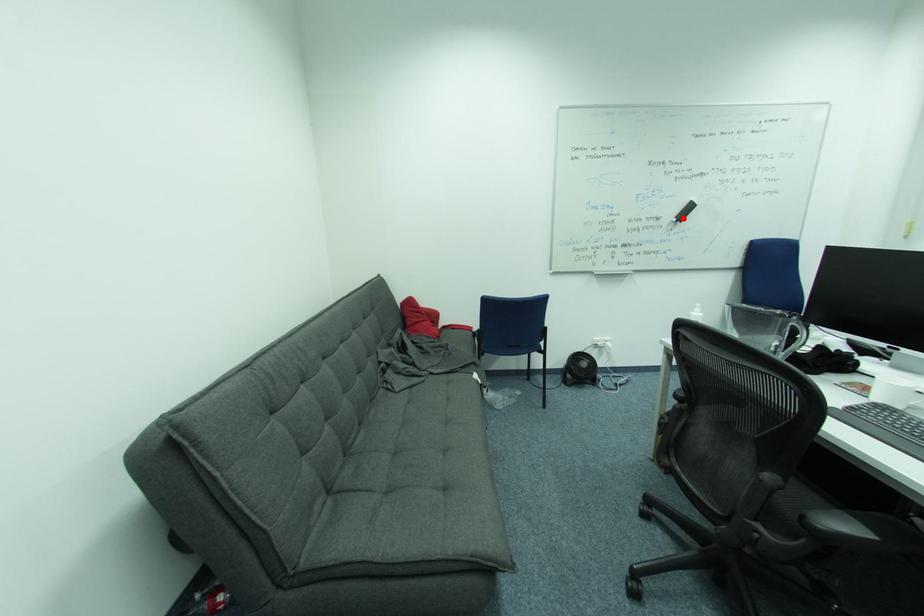
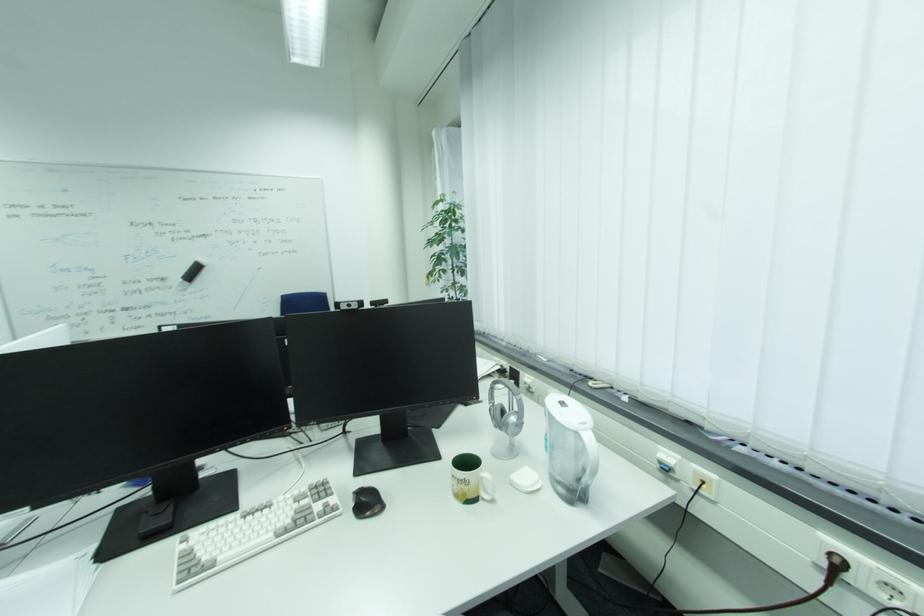
Find the pixel in the second image that matches the highlighted location in the first image.

(189, 278)